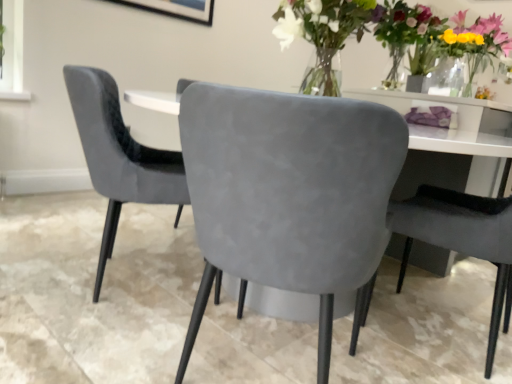
The height and width of the screenshot is (384, 512). What are the coordinates of `vacant space in velvet grey chair at center, which is the third chair from right to left (from a real-world perspective)` in the screenshot? It's located at (136, 278).